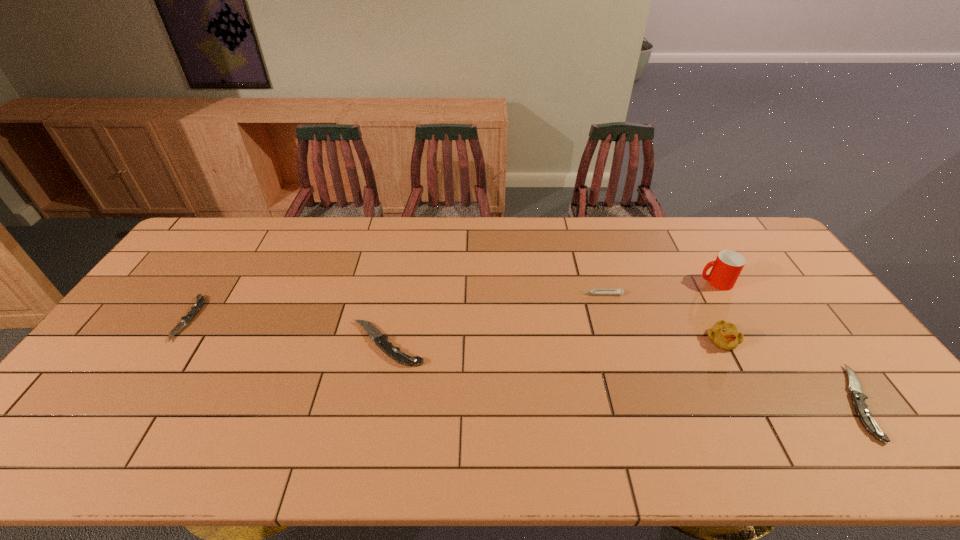
Please mark a free spot for a new pocketknife to balance the arrangement. Please provide its 2D coordinates. Your answer should be formatted as a tuple, i.e. [(x, y)], where the tuple contains the x and y coordinates of a point satisfying the conditions above.

[(610, 371)]